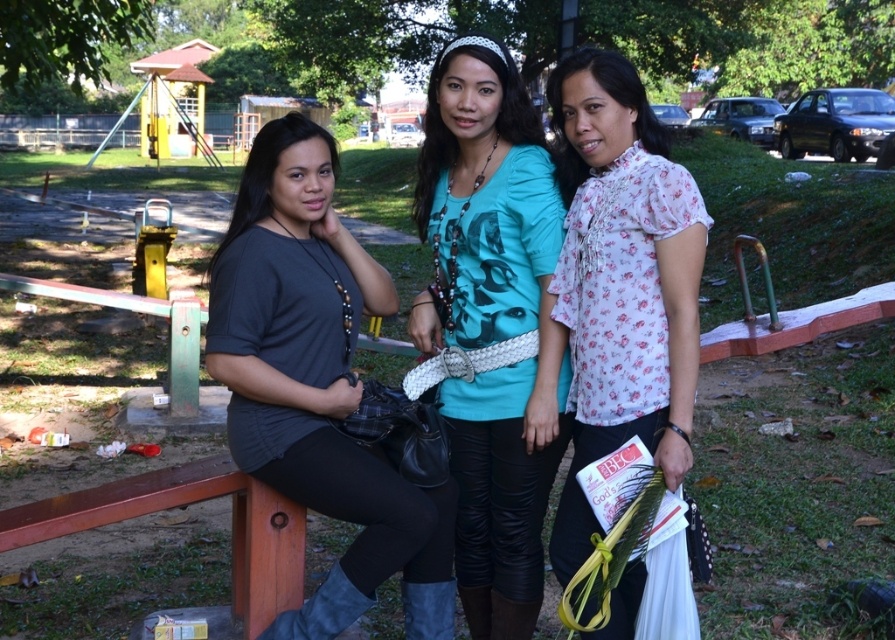
You are taking a photo of two women wearing the teal printed shirt at center and the white floral blouse at center. Which one is closer to the camera?

The teal printed shirt at center is positioned under the white floral blouse at center, so the white floral blouse at center is closer to the camera.

You are standing at the origin point in the park scene. The woman in the matte black shirt at left is at coordinates point 0.600, 0.354. If you want to walk directly to her location, which direction should you head?

Answer: The woman in the matte black shirt at left is located at coordinates point (316, 384). To reach her, you should move towards the northeast direction since the x and y coordinates are both positive, indicating movement to the right and upwards from the origin.